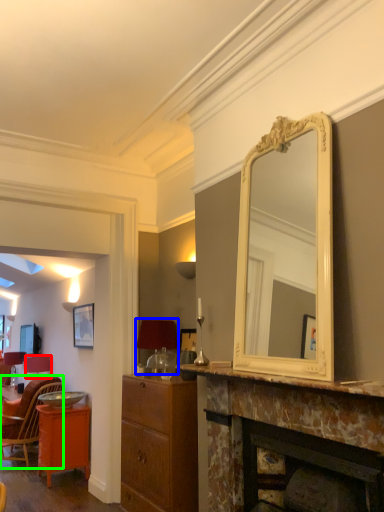
Question: Estimate the real-world distances between objects in this image. Which object is closer to lamp (highlighted by a red box), lamp (highlighted by a blue box) or chair (highlighted by a green box)?

Choices:
 (A) lamp
 (B) chair

Answer: (B)